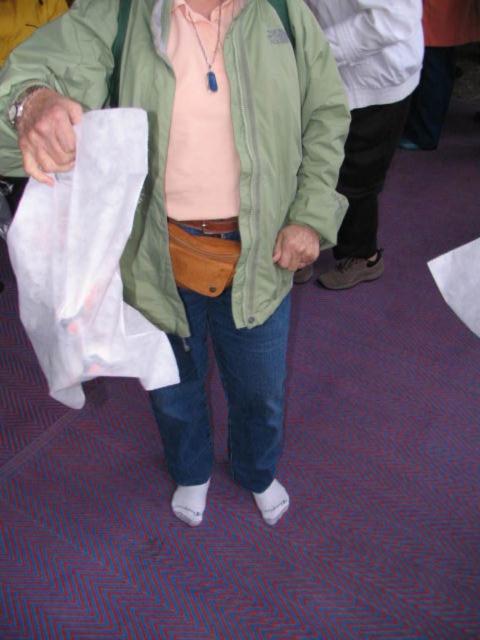
Question: Which point is closer to the camera?

Choices:
 (A) (242, 42)
 (B) (48, 150)

Answer: (B)

Question: Is green matte jacket at center smaller than leather glove at lower left?

Choices:
 (A) yes
 (B) no

Answer: (B)

Question: Does green matte jacket at center appear on the left side of leather glove at lower left?

Choices:
 (A) no
 (B) yes

Answer: (A)

Question: Is green matte jacket at center thinner than leather glove at lower left?

Choices:
 (A) yes
 (B) no

Answer: (B)

Question: Which point is closer to the camera?

Choices:
 (A) leather glove at lower left
 (B) green matte jacket at center

Answer: (A)

Question: Which object appears closest to the camera in this image?

Choices:
 (A) leather glove at lower left
 (B) green matte jacket at center

Answer: (A)